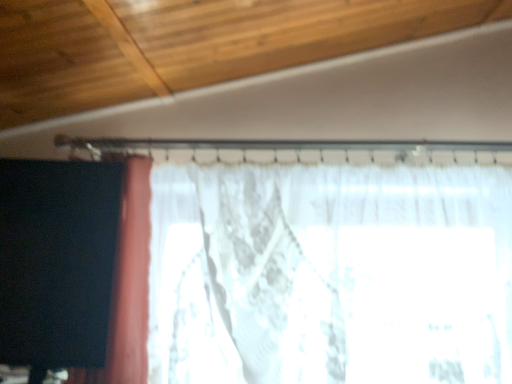
Question: Based on their positions, is white lace curtain at left, the second curtain viewed from the left, located to the left or right of black matte curtain at left, which is counted as the 1th curtain, starting from the left?

Choices:
 (A) left
 (B) right

Answer: (B)

Question: Looking at their shapes, would you say white lace curtain at left, acting as the 1th curtain starting from the right, is wider or thinner than black matte curtain at left, which is counted as the 1th curtain, starting from the left?

Choices:
 (A) thin
 (B) wide

Answer: (B)

Question: Is white lace curtain at left, acting as the 1th curtain starting from the right, situated inside black matte curtain at left, the 2th curtain viewed from the right, or outside?

Choices:
 (A) inside
 (B) outside

Answer: (B)

Question: Is black matte curtain at left, which is counted as the 1th curtain, starting from the left, in front of or behind white lace curtain at left, the second curtain viewed from the left, in the image?

Choices:
 (A) front
 (B) behind

Answer: (A)

Question: Does point (6, 249) appear closer or farther from the camera than point (296, 221)?

Choices:
 (A) farther
 (B) closer

Answer: (B)

Question: In terms of size, does black matte curtain at left, the 2th curtain viewed from the right, appear bigger or smaller than white lace curtain at left, acting as the 1th curtain starting from the right?

Choices:
 (A) small
 (B) big

Answer: (A)

Question: From a real-world perspective, is black matte curtain at left, the 2th curtain viewed from the right, above or below white lace curtain at left, acting as the 1th curtain starting from the right?

Choices:
 (A) above
 (B) below

Answer: (A)